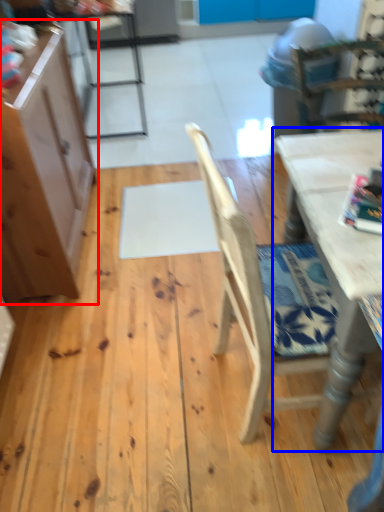
Question: Which object appears closest to the camera in this image, cabinetry (highlighted by a red box) or table (highlighted by a blue box)?

Choices:
 (A) cabinetry
 (B) table

Answer: (B)